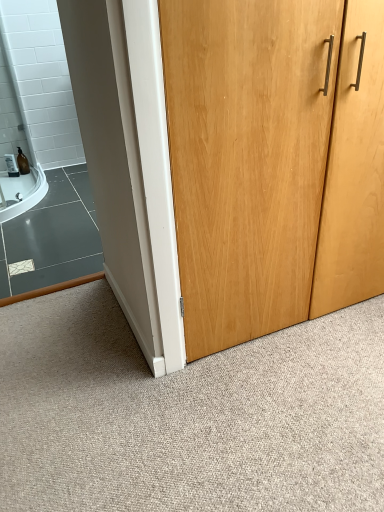
Locate an element on the screen. This screenshot has width=384, height=512. natural wood door at center is located at coordinates (188, 415).

Looking at this image, in order to face natural wood door at center, should I rotate leftwards or rightwards?

Turn right by 4.637 degrees to look at natural wood door at center.

This screenshot has height=512, width=384. What do you see at coordinates (188, 415) in the screenshot?
I see `natural wood door at center` at bounding box center [188, 415].

What are the coordinates of `light brown wood door at center` in the screenshot? It's located at (274, 161).

Image resolution: width=384 pixels, height=512 pixels. What do you see at coordinates (274, 161) in the screenshot?
I see `light brown wood door at center` at bounding box center [274, 161].

You are a GUI agent. You are given a task and a screenshot of the screen. Output one action in this format:
    pyautogui.click(x=<x>, y=<y>)
    Task: Click on the natural wood door at center
    
    Given the screenshot: What is the action you would take?
    pyautogui.click(x=188, y=415)

Which object is positioned more to the right, light brown wood door at center or natural wood door at center?

From the viewer's perspective, light brown wood door at center appears more on the right side.

Is light brown wood door at center in front of natural wood door at center?

No.

Does point (289, 190) come farther from viewer compared to point (299, 411)?

Yes, it is behind point (299, 411).

From the image's perspective, is light brown wood door at center on top of natural wood door at center?

Correct, light brown wood door at center appears higher than natural wood door at center in the image.

From a real-world perspective, which is physically below, light brown wood door at center or natural wood door at center?

In real-world perspective, natural wood door at center is lower.

Is light brown wood door at center thinner than natural wood door at center?

Indeed, light brown wood door at center has a lesser width compared to natural wood door at center.

Between light brown wood door at center and natural wood door at center, which one has more height?

light brown wood door at center is taller.

Looking at the image, does light brown wood door at center seem bigger or smaller compared to natural wood door at center?

Clearly, light brown wood door at center is smaller in size than natural wood door at center.

Is light brown wood door at center inside or outside of natural wood door at center?

light brown wood door at center cannot be found inside natural wood door at center.

Based on the photo, are light brown wood door at center and natural wood door at center far apart?

No, light brown wood door at center is in close proximity to natural wood door at center.

Is light brown wood door at center facing away from natural wood door at center?

Yes, light brown wood door at center's orientation is away from natural wood door at center.

Locate an element on the screen. Image resolution: width=384 pixels, height=512 pixels. granite in front of the light brown wood door at center is located at coordinates (188, 415).

Considering the relative positions of natural wood door at center and light brown wood door at center in the image provided, is natural wood door at center to the left of light brown wood door at center from the viewer's perspective?

Yes.

Is natural wood door at center closer to the viewer compared to light brown wood door at center?

Yes, the depth of natural wood door at center is less than that of light brown wood door at center.

Does point (215, 436) come behind point (311, 305)?

That is False.

From the image's perspective, is natural wood door at center on top of light brown wood door at center?

No.

From a real-world perspective, is natural wood door at center beneath light brown wood door at center?

Indeed, from a real-world perspective, natural wood door at center is positioned beneath light brown wood door at center.

Does natural wood door at center have a greater width compared to light brown wood door at center?

Indeed, natural wood door at center has a greater width compared to light brown wood door at center.

Which of these two, natural wood door at center or light brown wood door at center, stands taller?

light brown wood door at center is taller.

Is natural wood door at center bigger than light brown wood door at center?

Yes, natural wood door at center is bigger than light brown wood door at center.

Choose the correct answer: Is natural wood door at center inside light brown wood door at center or outside it?

natural wood door at center is spatially situated outside light brown wood door at center.

Are natural wood door at center and light brown wood door at center located far from each other?

No.

From the picture: Is natural wood door at center positioned with its back to light brown wood door at center?

That's right, natural wood door at center is facing away from light brown wood door at center.

How different are the orientations of natural wood door at center and light brown wood door at center in degrees?

179 degrees.

The width and height of the screenshot is (384, 512). In order to click on granite below the light brown wood door at center (from the image's perspective) in this screenshot , I will do `click(188, 415)`.

At what (x,y) coordinates should I click in order to perform the action: click on granite that appears on the left of light brown wood door at center. Please return your answer as a coordinate pair (x, y). The height and width of the screenshot is (512, 384). Looking at the image, I should click on (188, 415).

Find the location of a particular element. The width and height of the screenshot is (384, 512). granite in front of the light brown wood door at center is located at coordinates (188, 415).